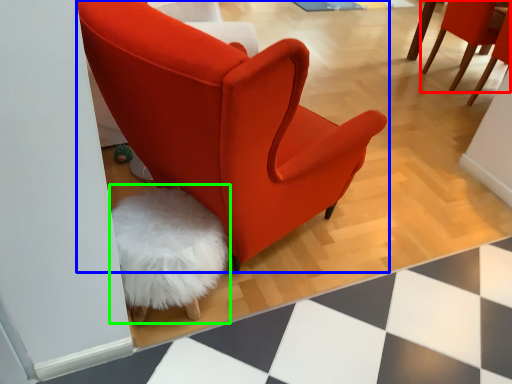
Question: Considering the real-world distances, which object is closest to chair (highlighted by a red box)? chair (highlighted by a blue box) or swivel chair (highlighted by a green box).

Choices:
 (A) chair
 (B) swivel chair

Answer: (A)